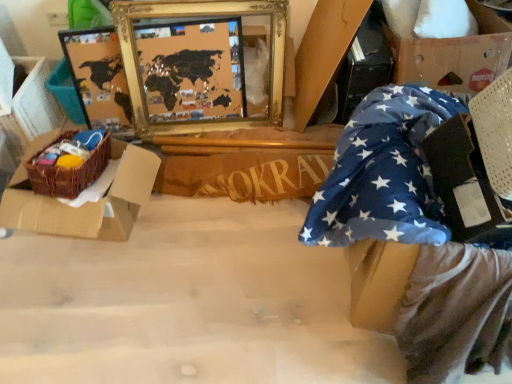
Where is `free space in front of brown woven basket at left`? The width and height of the screenshot is (512, 384). free space in front of brown woven basket at left is located at coordinates (95, 318).